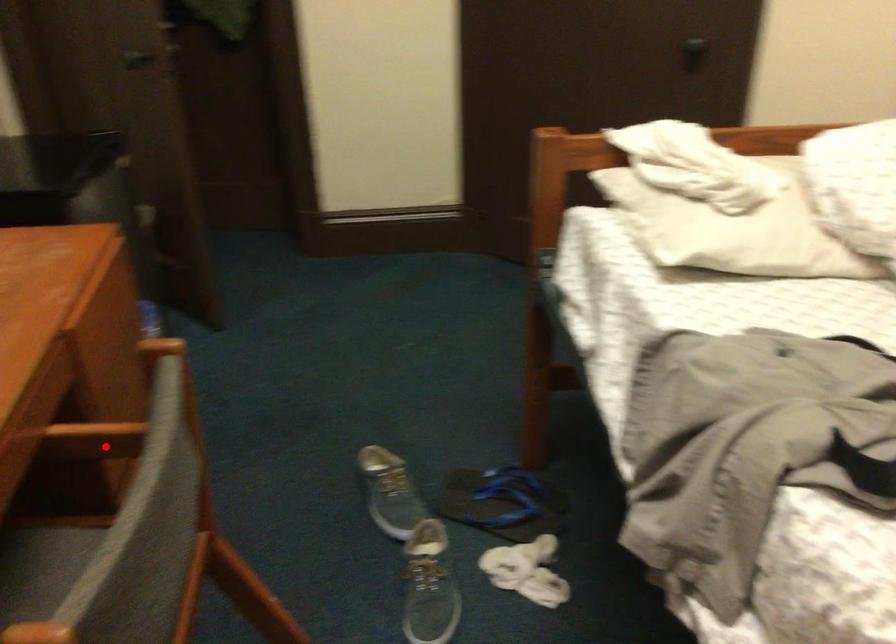
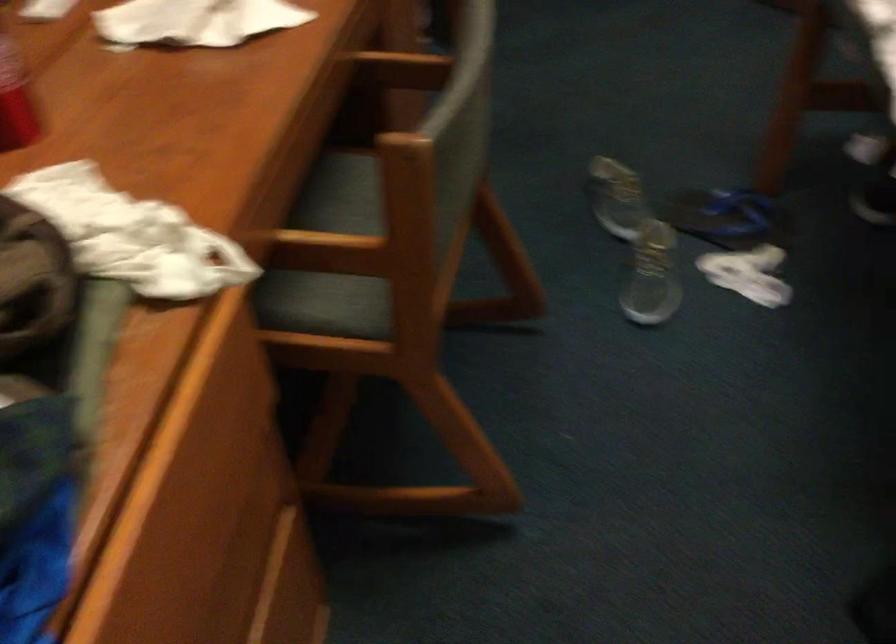
Question: I am providing you with two images of the same scene from different viewpoints. Given a red point in image1, look at the same physical point in image2. Is it:

Choices:
 (A) Closer to the viewpoint
 (B) Farther from the viewpoint

Answer: (B)